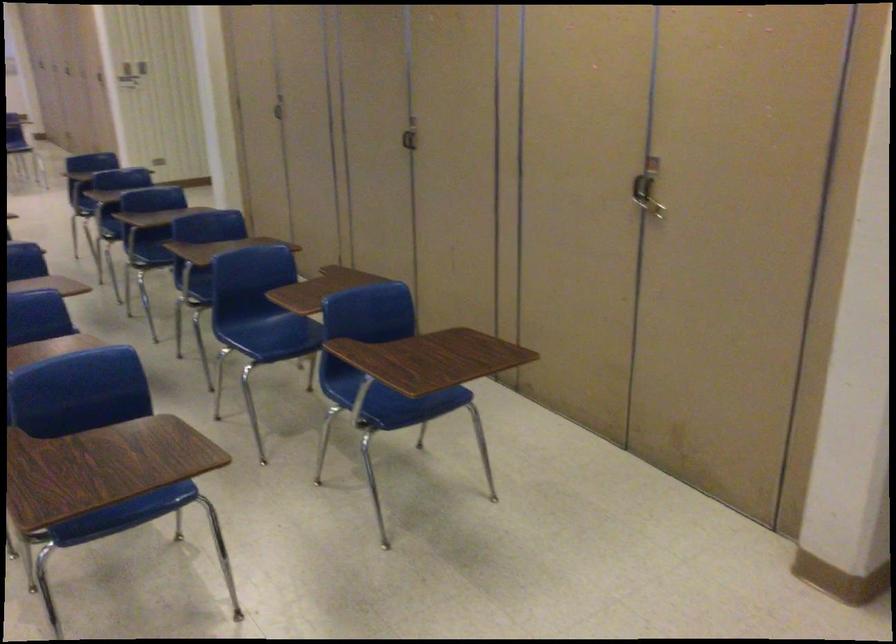
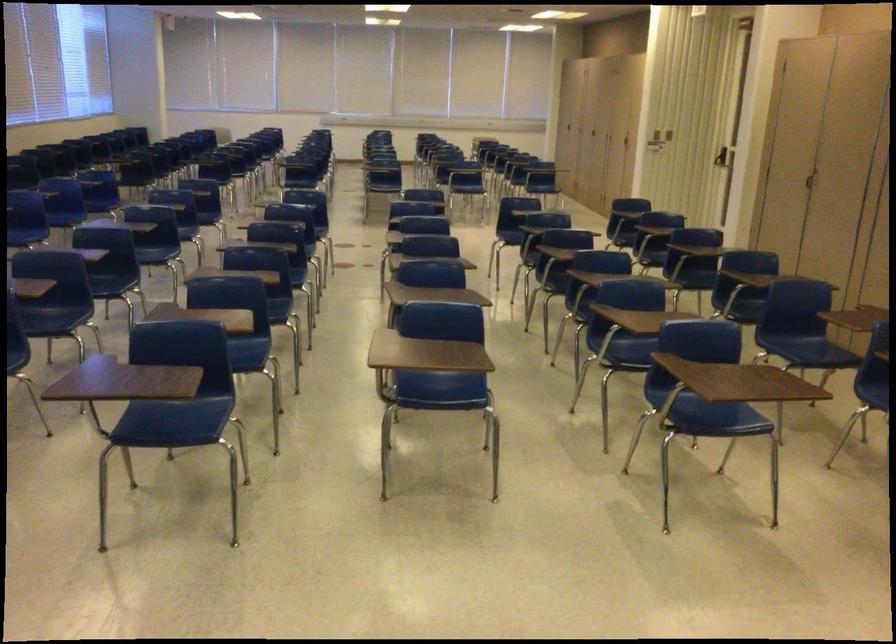
Locate, in the second image, the point that corresponds to (x=319, y=100) in the first image.

(853, 173)